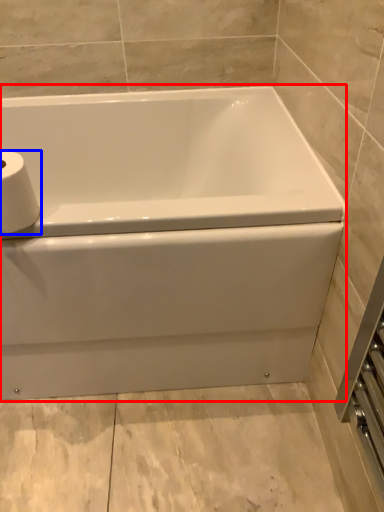
Question: Which of the following is the closest to the observer, bathtub (highlighted by a red box) or toilet paper (highlighted by a blue box)?

Choices:
 (A) bathtub
 (B) toilet paper

Answer: (B)